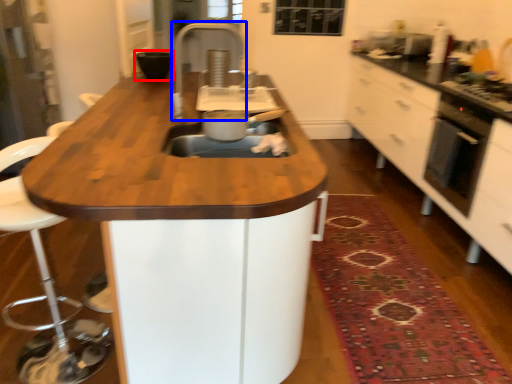
Question: Which of the following is the farthest to the observer, appliance (highlighted by a red box) or faucet (highlighted by a blue box)?

Choices:
 (A) appliance
 (B) faucet

Answer: (A)